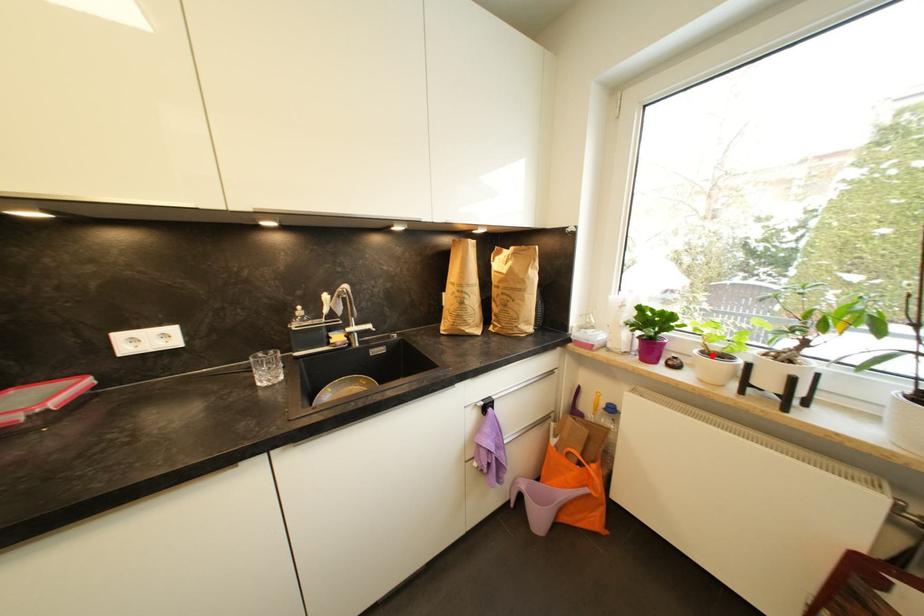
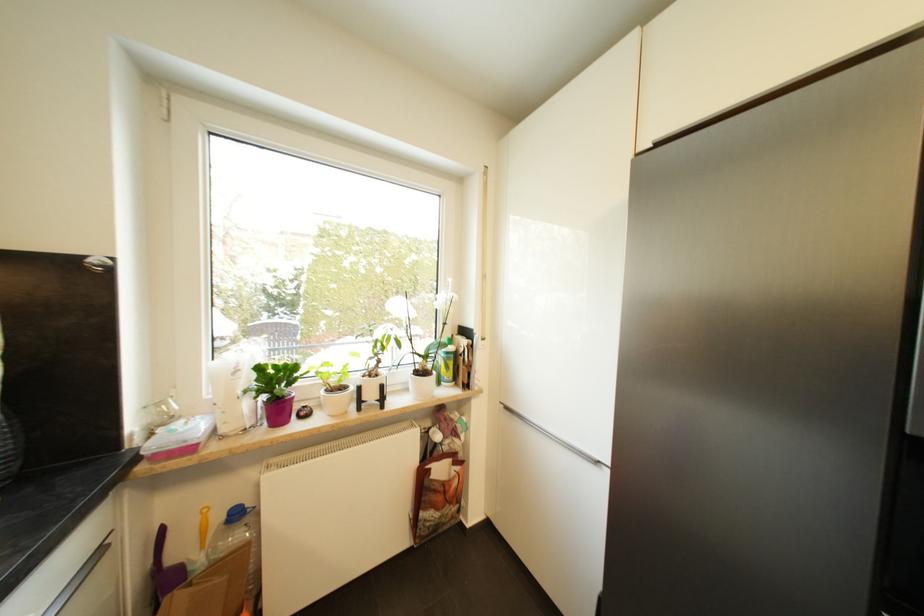
In the second image, find the point that corresponds to the highlighted location in the first image.

(336, 392)